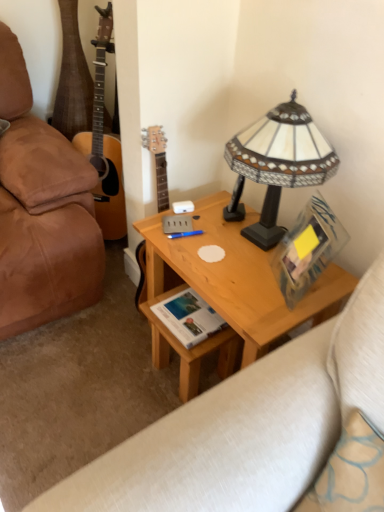
Describe the element at coordinates (248, 426) in the screenshot. I see `leather studio couch at lower left` at that location.

The image size is (384, 512). Find the location of `light wood desk at center`. light wood desk at center is located at coordinates (227, 290).

Measure the distance between white paper book at center and camera.

The distance of white paper book at center from camera is 4.38 feet.

At what (x,y) coordinates should I click in order to perform the action: click on leather studio couch at lower left. Please return your answer as a coordinate pair (x, y). Image resolution: width=384 pixels, height=512 pixels. Looking at the image, I should click on (248, 426).

Which of these two, white paper book at center or blue plastic pen at center, stands taller?

With more height is white paper book at center.

Does point (205, 325) appear closer or farther from the camera than point (193, 234)?

Point (205, 325) is positioned closer to the camera compared to point (193, 234).

Is white paper book at center next to blue plastic pen at center?

white paper book at center is not next to blue plastic pen at center, and they're not touching.

Can you confirm if white paper book at center is thinner than blue plastic pen at center?

Incorrect, the width of white paper book at center is not less than that of blue plastic pen at center.

Based on the photo, is blue plastic pen at center facing away from light wood desk at center?

That's right, blue plastic pen at center is facing away from light wood desk at center.

Locate an element on the screen. The image size is (384, 512). desk beneath the blue plastic pen at center (from a real-world perspective) is located at coordinates (227, 290).

Is blue plastic pen at center not near light wood desk at center?

No, blue plastic pen at center is not far away from light wood desk at center.

Would you say blue plastic pen at center contains light wood desk at center?

No, light wood desk at center is located outside of blue plastic pen at center.

From a real-world perspective, is light wood desk at center positioned under leather studio couch at lower left based on gravity?

No, from a real-world perspective, light wood desk at center is not beneath leather studio couch at lower left.

Is light wood desk at center taller than leather studio couch at lower left?

Yes.

In the scene shown: From the image's perspective, which is above, light wood desk at center or leather studio couch at lower left?

light wood desk at center.

Between point (333, 278) and point (39, 504), which one is positioned in front?

Point (39, 504)

This screenshot has width=384, height=512. In order to click on desk lying below the blue plastic pen at center (from the image's perspective) in this screenshot , I will do `click(227, 290)`.

Can you confirm if light wood desk at center is positioned to the left of blue plastic pen at center?

No, light wood desk at center is not to the left of blue plastic pen at center.

Between light wood desk at center and blue plastic pen at center, which one is positioned behind?

blue plastic pen at center is behind.

What's the angular difference between light wood desk at center and blue plastic pen at center's facing directions?

They differ by 70.8 degrees in their facing directions.

Between point (332, 167) and point (206, 324), which one is positioned in front?

The point (332, 167) is closer to the camera.

Between stained glass lampshade at upper right and white paper book at center, which one has less height?

Standing shorter between the two is white paper book at center.

Identify the location of book that is below the stained glass lampshade at upper right (from the image's perspective). (188, 317).

Which of these two, stained glass lampshade at upper right or white paper book at center, is smaller?

white paper book at center.

Is point (173, 236) in front of point (310, 164)?

No.

From the image's perspective, which one is positioned lower, blue plastic pen at center or stained glass lampshade at upper right?

blue plastic pen at center.

Does blue plastic pen at center have a greater width compared to stained glass lampshade at upper right?

Incorrect, the width of blue plastic pen at center does not surpass that of stained glass lampshade at upper right.

The image size is (384, 512). Find the location of `lamp located in front of the blue plastic pen at center`. lamp located in front of the blue plastic pen at center is located at coordinates (277, 164).

Considering their positions, is white paper book at center located in front of or behind stained glass lampshade at upper right?

Visually, white paper book at center is located behind stained glass lampshade at upper right.

From a real-world perspective, between white paper book at center and stained glass lampshade at upper right, who is vertically lower?

white paper book at center, from a real-world perspective.

Does white paper book at center have a smaller size compared to stained glass lampshade at upper right?

Correct, white paper book at center occupies less space than stained glass lampshade at upper right.

From the image's perspective, is white paper book at center over stained glass lampshade at upper right?

No, from the image's perspective, white paper book at center is not above stained glass lampshade at upper right.

You are a GUI agent. You are given a task and a screenshot of the screen. Output one action in this format:
    pyautogui.click(x=<x>, y=<y>)
    Task: Click on the book below the blue plastic pen at center (from a real-world perspective)
    
    Given the screenshot: What is the action you would take?
    pyautogui.click(x=188, y=317)

The width and height of the screenshot is (384, 512). I want to click on pen that is above the light wood desk at center (from a real-world perspective), so click(185, 234).

Looking at the image, which one is located further to white paper book at center, blue plastic pen at center or stained glass lampshade at upper right?

stained glass lampshade at upper right is positioned further to the anchor white paper book at center.

When comparing their distances from blue plastic pen at center, does light wood desk at center or stained glass lampshade at upper right seem closer?

The object closer to blue plastic pen at center is light wood desk at center.

Which object lies nearer to the anchor point stained glass lampshade at upper right, leather studio couch at lower left or white paper book at center?

white paper book at center lies closer to stained glass lampshade at upper right than the other object.

Which object lies further to the anchor point blue plastic pen at center, stained glass lampshade at upper right or light wood desk at center?

Based on the image, stained glass lampshade at upper right appears to be further to blue plastic pen at center.

From the image, which object appears to be nearer to white paper book at center, stained glass lampshade at upper right or light wood desk at center?

light wood desk at center is positioned closer to the anchor white paper book at center.

Which object lies nearer to the anchor point blue plastic pen at center, light wood desk at center or leather studio couch at lower left?

The object closer to blue plastic pen at center is light wood desk at center.

When comparing their distances from leather studio couch at lower left, does white paper book at center or light wood desk at center seem further?

white paper book at center lies further to leather studio couch at lower left than the other object.

From the image, which object appears to be nearer to blue plastic pen at center, leather studio couch at lower left or stained glass lampshade at upper right?

stained glass lampshade at upper right is positioned closer to the anchor blue plastic pen at center.

I want to click on pen between leather studio couch at lower left and white paper book at center from left to right, so (x=185, y=234).

Locate an element on the screen. book between stained glass lampshade at upper right and blue plastic pen at center from front to back is located at coordinates tap(188, 317).

Identify the location of pen between leather studio couch at lower left and stained glass lampshade at upper right. (185, 234).

Where is `book between light wood desk at center and blue plastic pen at center along the z-axis`? The height and width of the screenshot is (512, 384). book between light wood desk at center and blue plastic pen at center along the z-axis is located at coordinates (188, 317).